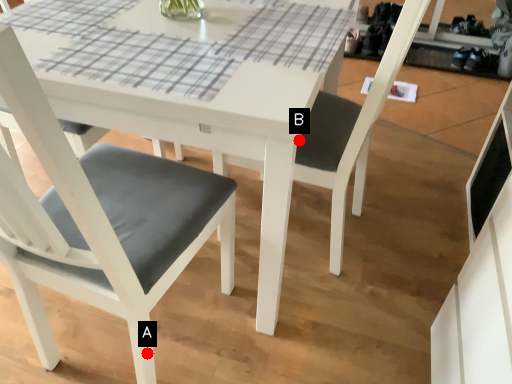
Question: Two points are circled on the image, labeled by A and B beside each circle. Which point is closer to the camera?

Choices:
 (A) A is closer
 (B) B is closer

Answer: (B)